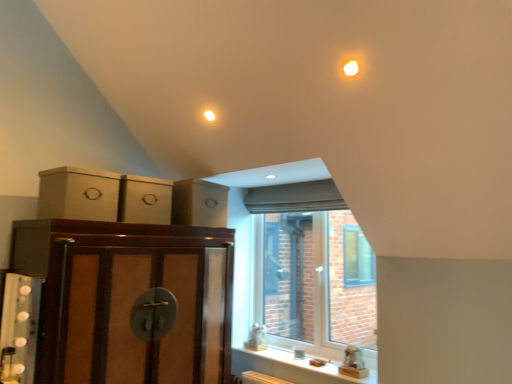
Question: Should I look upward or downward to see matte cardboard box at upper left, which is the first cabinetry in top-to-bottom order?

Choices:
 (A) up
 (B) down

Answer: (B)

Question: Is clear glass window at center positioned with its back to brown cardboard boxes at upper left, which ranks as the second cabinetry in top-to-bottom order?

Choices:
 (A) no
 (B) yes

Answer: (A)

Question: Does clear glass window at center come behind brown cardboard boxes at upper left, which ranks as the second cabinetry in top-to-bottom order?

Choices:
 (A) yes
 (B) no

Answer: (A)

Question: Is clear glass window at center completely or partially outside of brown cardboard boxes at upper left, which ranks as the second cabinetry in top-to-bottom order?

Choices:
 (A) yes
 (B) no

Answer: (A)

Question: Does clear glass window at center have a smaller size compared to brown cardboard boxes at upper left, the 2th cabinetry from the bottom?

Choices:
 (A) no
 (B) yes

Answer: (A)

Question: From the image's perspective, would you say clear glass window at center is shown under brown cardboard boxes at upper left, the 2th cabinetry from the bottom?

Choices:
 (A) no
 (B) yes

Answer: (B)

Question: Is clear glass window at center shorter than brown cardboard boxes at upper left, the 2th cabinetry from the bottom?

Choices:
 (A) no
 (B) yes

Answer: (A)

Question: From the image's perspective, does matte cardboard box at upper left, placed as the third cabinetry when sorted from bottom to top, appear lower than brown wood cabinet at left, marked as the 1th cabinetry in a bottom-to-top arrangement?

Choices:
 (A) yes
 (B) no

Answer: (B)

Question: Does matte cardboard box at upper left, which is the first cabinetry in top-to-bottom order, have a greater height compared to brown wood cabinet at left, marked as the 1th cabinetry in a bottom-to-top arrangement?

Choices:
 (A) yes
 (B) no

Answer: (B)

Question: From the image's perspective, is matte cardboard box at upper left, placed as the third cabinetry when sorted from bottom to top, on top of brown wood cabinet at left, positioned as the third cabinetry in top-to-bottom order?

Choices:
 (A) yes
 (B) no

Answer: (A)

Question: Can you confirm if matte cardboard box at upper left, which is the first cabinetry in top-to-bottom order, is thinner than brown wood cabinet at left, marked as the 1th cabinetry in a bottom-to-top arrangement?

Choices:
 (A) yes
 (B) no

Answer: (A)

Question: From a real-world perspective, is matte cardboard box at upper left, which is the first cabinetry in top-to-bottom order, beneath brown wood cabinet at left, positioned as the third cabinetry in top-to-bottom order?

Choices:
 (A) no
 (B) yes

Answer: (A)

Question: Considering the relative sizes of matte cardboard box at upper left, placed as the third cabinetry when sorted from bottom to top, and brown wood cabinet at left, positioned as the third cabinetry in top-to-bottom order, in the image provided, is matte cardboard box at upper left, placed as the third cabinetry when sorted from bottom to top, smaller than brown wood cabinet at left, positioned as the third cabinetry in top-to-bottom order,?

Choices:
 (A) no
 (B) yes

Answer: (B)

Question: From a real-world perspective, is brown wood cabinet at left, positioned as the third cabinetry in top-to-bottom order, positioned over matte cardboard drawer at upper left based on gravity?

Choices:
 (A) no
 (B) yes

Answer: (A)